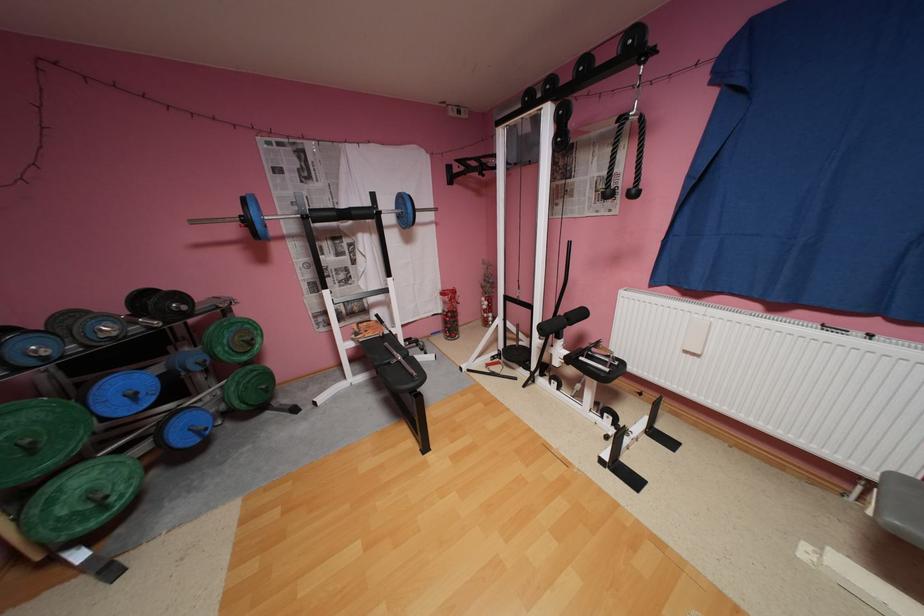
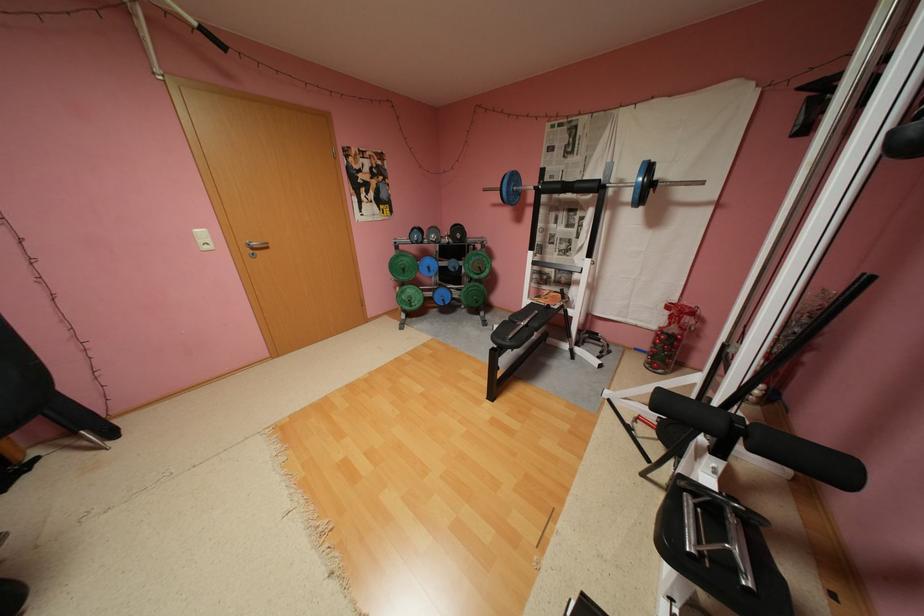
Where in the second image is the point corresponding to point 150,394 from the first image?

(441, 269)